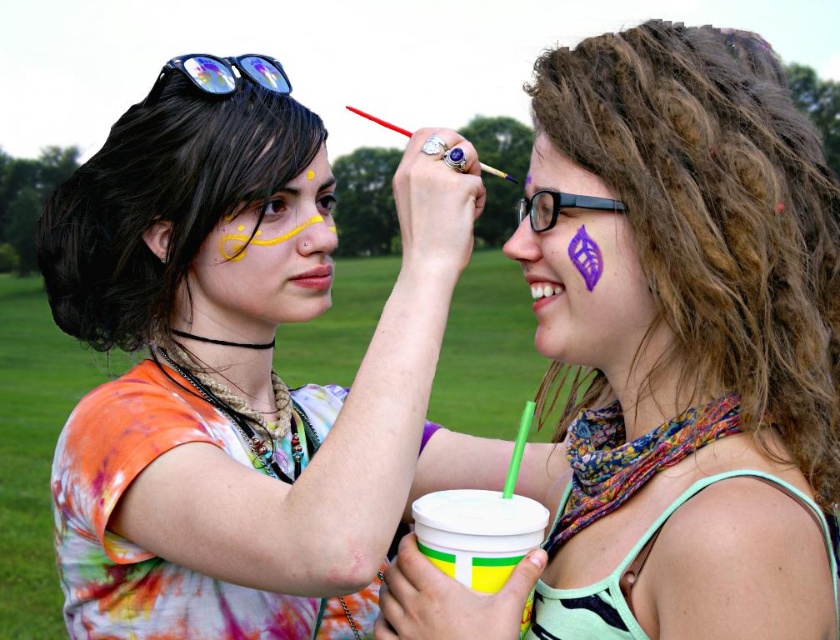
Question: Which object is the farthest from the matte yellow paint at upper center?

Choices:
 (A) brown matte eye at upper center
 (B) shiny blue eye at center

Answer: (B)

Question: Is matte yellow face paint at upper left smaller than purple matte leaf at center?

Choices:
 (A) yes
 (B) no

Answer: (B)

Question: Does purple matte face paint at upper right have a lesser width compared to yellow matte paint at upper center?

Choices:
 (A) yes
 (B) no

Answer: (B)

Question: Does yellow matte paint at left have a smaller size compared to yellow matte paint at upper center?

Choices:
 (A) yes
 (B) no

Answer: (B)

Question: Which of the following is the farthest from the observer?

Choices:
 (A) (177, 100)
 (B) (319, 132)

Answer: (B)

Question: Which of the following is the farthest from the observer?

Choices:
 (A) purple matte leaf at center
 (B) yellow matte dot at upper center
 (C) brown matte eye at upper center

Answer: (C)